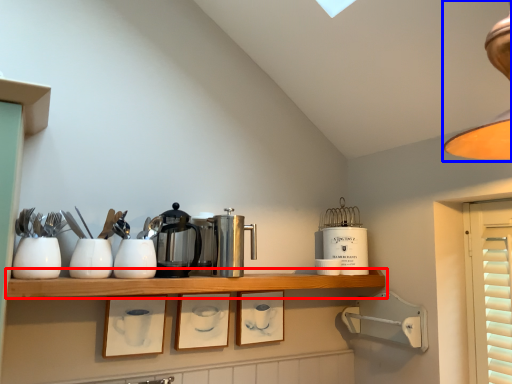
Question: Which object is closer to the camera taking this photo, shelf (highlighted by a red box) or lamp (highlighted by a blue box)?

Choices:
 (A) shelf
 (B) lamp

Answer: (B)